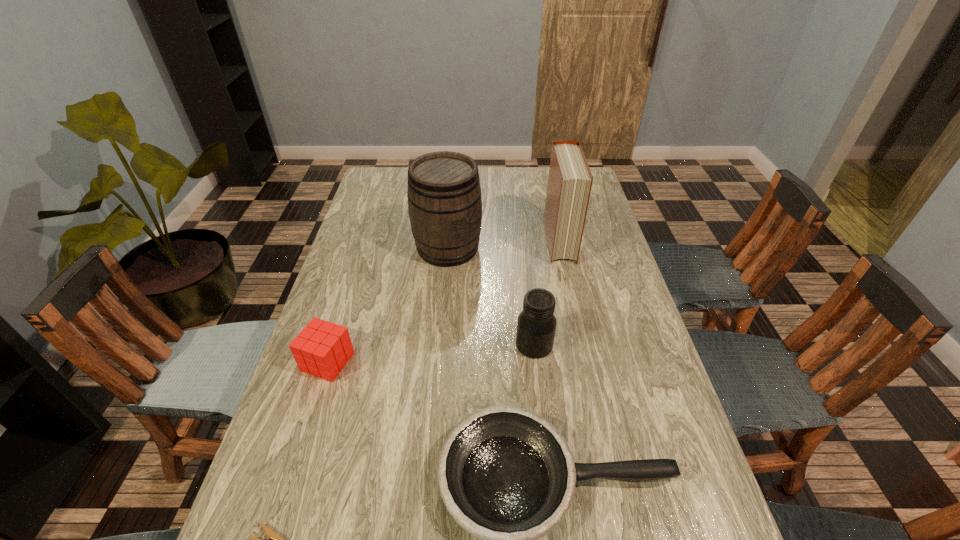
Image resolution: width=960 pixels, height=540 pixels. Identify the location of free region at the far edge. (482, 191).

Locate an element on the screen. This screenshot has width=960, height=540. vacant space at the left edge of the desktop is located at coordinates (389, 241).

This screenshot has height=540, width=960. Find the location of `vacant area at the right edge`. vacant area at the right edge is located at coordinates (588, 243).

Find the location of a particular element. This screenshot has width=960, height=540. free space at the far left corner is located at coordinates (376, 189).

Locate an element on the screen. The width and height of the screenshot is (960, 540). empty space between the hardback book and the wine bucket is located at coordinates (503, 245).

This screenshot has height=540, width=960. Identify the location of unoccupied position between the wine bucket and the hardback book. 503,245.

Locate which object is the fifth closest to the hardback book. Please provide its 2D coordinates. Your answer should be formatted as a tuple, i.e. [(x, y)], where the tuple contains the x and y coordinates of a point satisfying the conditions above.

[(275, 539)]

Identify the location of object identified as the closest to the wine bucket. click(x=570, y=180).